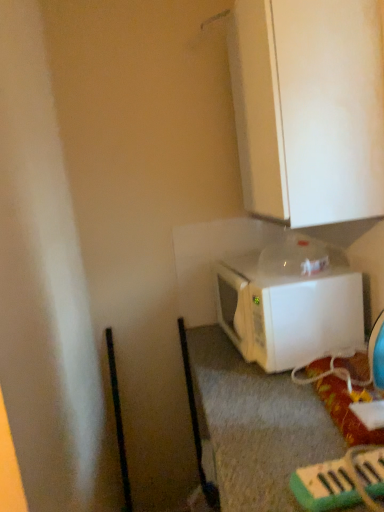
Question: From the image's perspective, is white matte microwave at lower right above or below white matte cabinet at upper center?

Choices:
 (A) below
 (B) above

Answer: (A)

Question: Considering the positions of point (355, 314) and point (377, 113), is point (355, 314) closer or farther from the camera than point (377, 113)?

Choices:
 (A) closer
 (B) farther

Answer: (B)

Question: Considering the positions of white matte microwave at lower right and white matte cabinet at upper center in the image, is white matte microwave at lower right taller or shorter than white matte cabinet at upper center?

Choices:
 (A) short
 (B) tall

Answer: (A)

Question: Is white matte cabinet at upper center inside or outside of white matte microwave at lower right?

Choices:
 (A) inside
 (B) outside

Answer: (B)

Question: Looking at their shapes, would you say white matte cabinet at upper center is wider or thinner than white matte microwave at lower right?

Choices:
 (A) thin
 (B) wide

Answer: (A)

Question: Considering the positions of white matte cabinet at upper center and white matte microwave at lower right in the image, is white matte cabinet at upper center bigger or smaller than white matte microwave at lower right?

Choices:
 (A) small
 (B) big

Answer: (B)

Question: Based on their positions, is white matte cabinet at upper center located to the left or right of white matte microwave at lower right?

Choices:
 (A) left
 (B) right

Answer: (B)